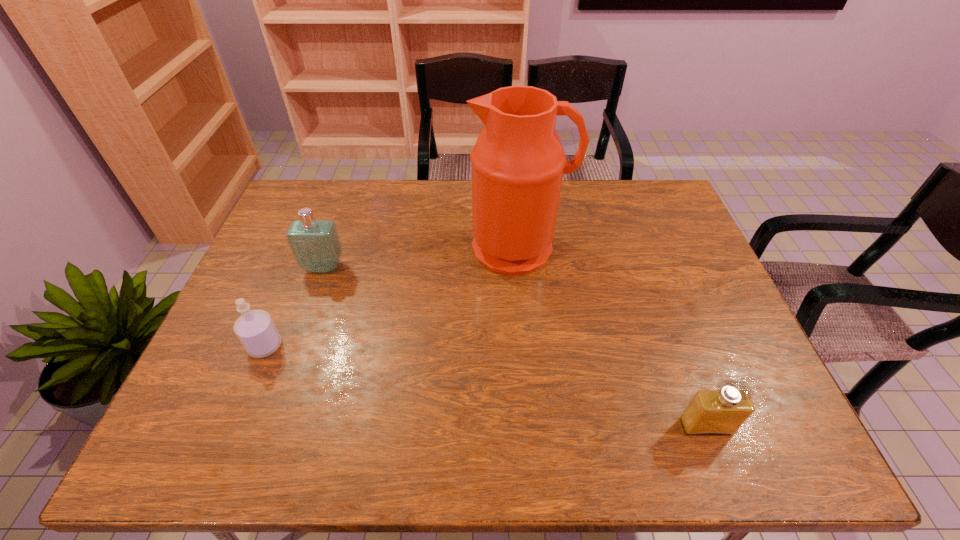
Where is `free spot between the tallest perfume and the second nearest perfume`? free spot between the tallest perfume and the second nearest perfume is located at coordinates (295, 307).

Identify the location of free space between the third farthest object and the tallest perfume. (295, 307).

The height and width of the screenshot is (540, 960). I want to click on free space between the farthest perfume and the rightmost perfume, so click(x=515, y=347).

The height and width of the screenshot is (540, 960). Find the location of `free space between the second tallest object and the third object from left to right`. free space between the second tallest object and the third object from left to right is located at coordinates (421, 258).

Identify the location of free space between the tallest object and the nearest object. This screenshot has height=540, width=960. (612, 337).

Locate an element on the screen. Image resolution: width=960 pixels, height=540 pixels. free space between the tallest object and the rightmost perfume is located at coordinates (612, 337).

The width and height of the screenshot is (960, 540). Find the location of `empty space between the third shortest object and the tallest object`. empty space between the third shortest object and the tallest object is located at coordinates (421, 258).

Find the location of a particular element. empty location between the nearest perfume and the tallest perfume is located at coordinates (515, 347).

Identify which object is the closest to the water jug. Please provide its 2D coordinates. Your answer should be formatted as a tuple, i.e. [(x, y)], where the tuple contains the x and y coordinates of a point satisfying the conditions above.

[(315, 244)]

Select which object appears as the second closest to the third farthest object. Please provide its 2D coordinates. Your answer should be formatted as a tuple, i.e. [(x, y)], where the tuple contains the x and y coordinates of a point satisfying the conditions above.

[(518, 162)]